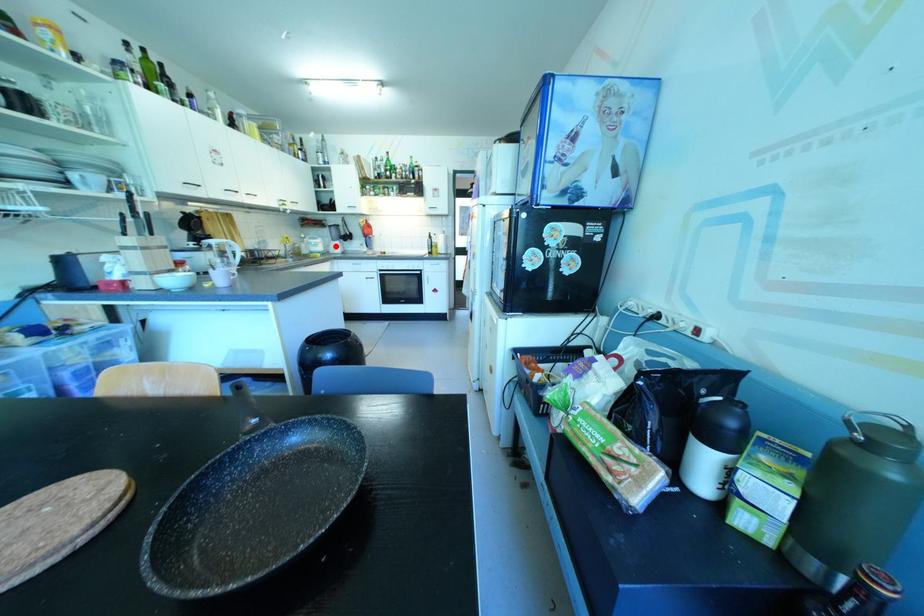
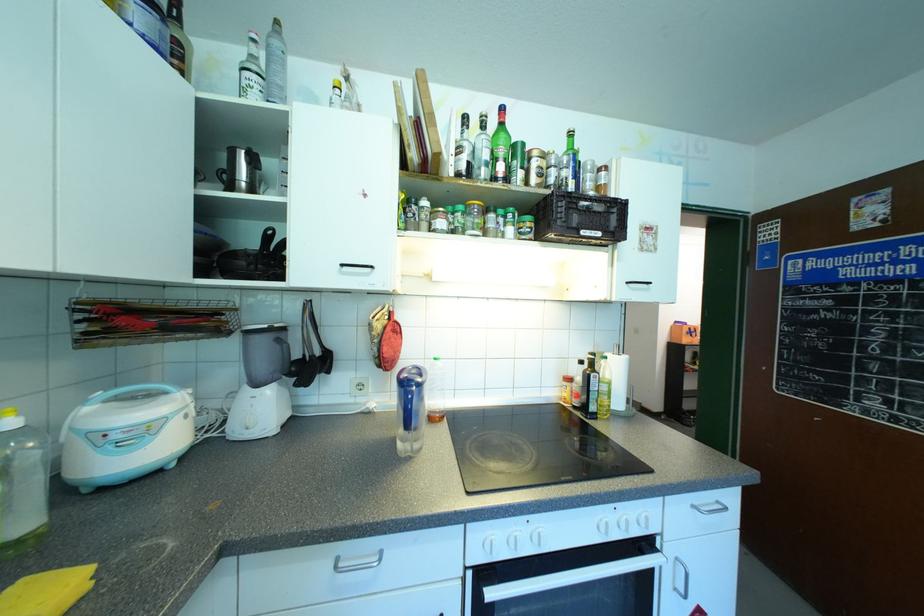
The point at the highlighted location is marked in the first image. Where is the corresponding point in the second image?

(262, 410)